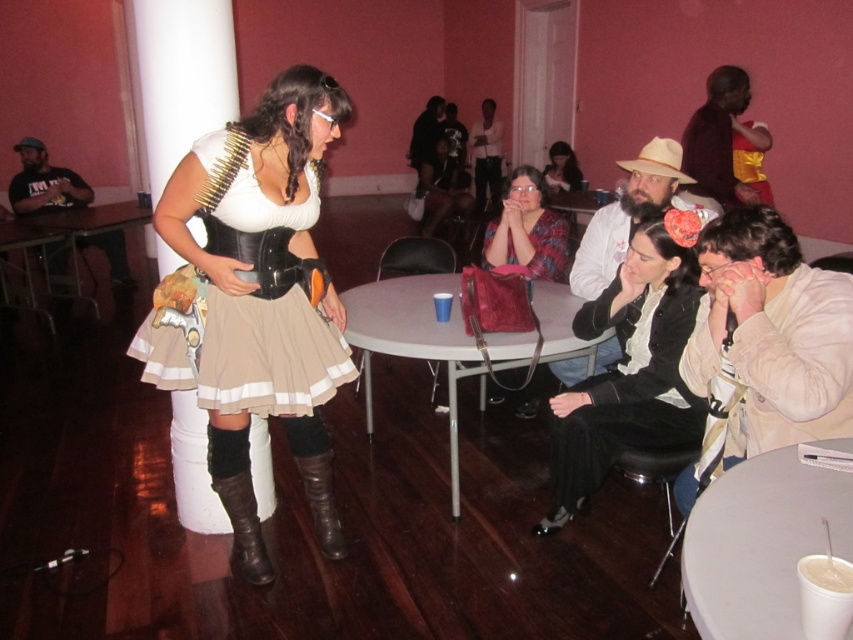
Who is taller, black t-shirt at left or printed fabric blouse at center?

With more height is black t-shirt at left.

Is point (119, 269) positioned behind point (486, 248)?

That is True.

The width and height of the screenshot is (853, 640). I want to click on black t-shirt at left, so click(x=44, y=182).

Which is in front, point (804, 388) or point (824, 516)?

Point (824, 516) is more forward.

Does white cotton shirt at right appear on the right side of white plastic cup at lower right?

Yes, white cotton shirt at right is to the right of white plastic cup at lower right.

Is point (728, 256) positioned behind point (686, 545)?

Yes, point (728, 256) is behind point (686, 545).

The width and height of the screenshot is (853, 640). Identify the location of white cotton shirt at right. (770, 333).

Which is above, matte black skirt at center or black t-shirt at left?

black t-shirt at left is higher up.

Does matte black skirt at center have a smaller size compared to black t-shirt at left?

No, matte black skirt at center is not smaller than black t-shirt at left.

Who is more forward, (305, 452) or (84, 241)?

Point (305, 452) is more forward.

Where is `matte black skirt at center`? The height and width of the screenshot is (640, 853). matte black skirt at center is located at coordinates (258, 298).